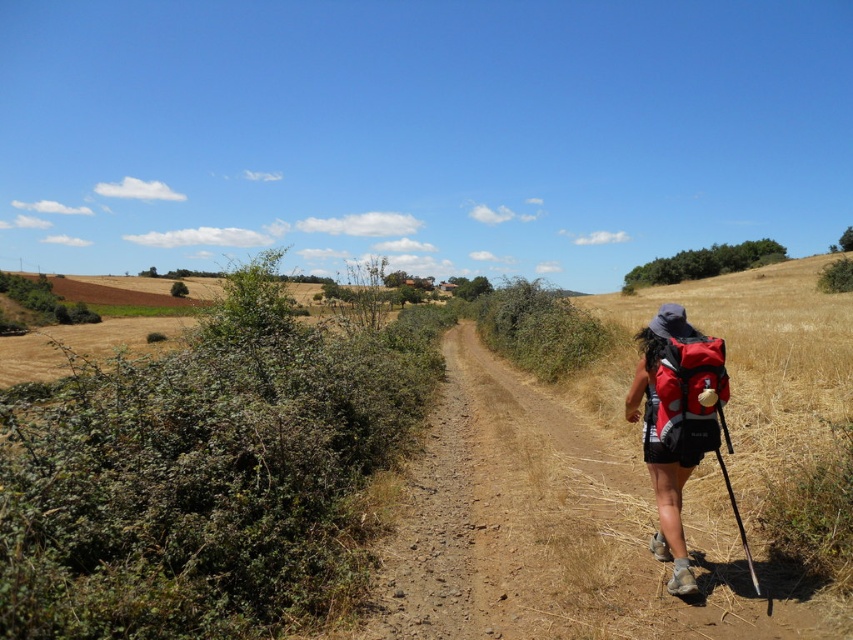
You are a hiker who needs to choose between the red fabric backpack at right and the red matte backpack at right. Which one can carry more items based on their sizes?

The red fabric backpack at right has a larger size compared to the red matte backpack at right, so it can carry more items.

You are a hiker who wants to check the contents of both the red fabric backpack at right and the red matte backpack at right. Which one do you need to reach for first without moving your position?

You should reach for the red fabric backpack at right first because it is closer to you than the red matte backpack at right.